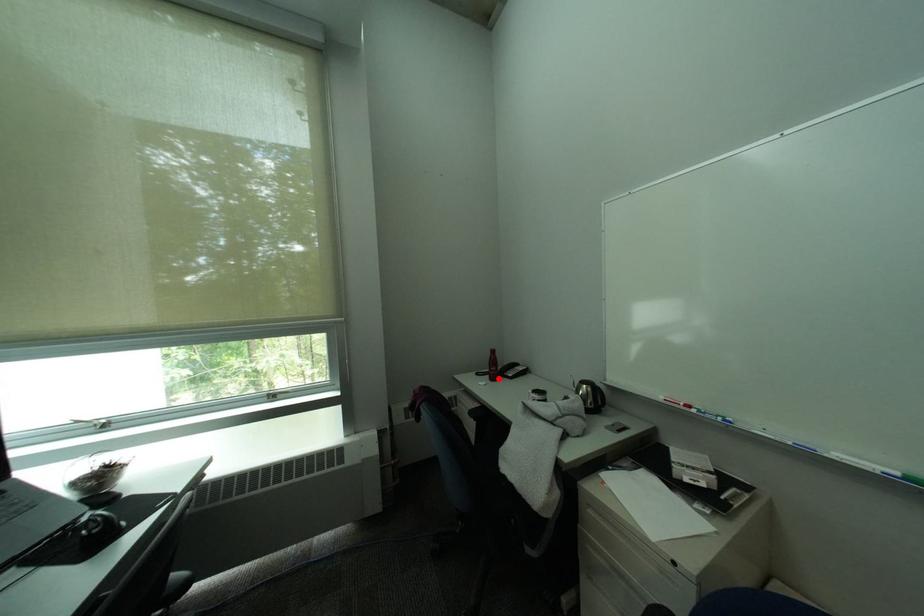
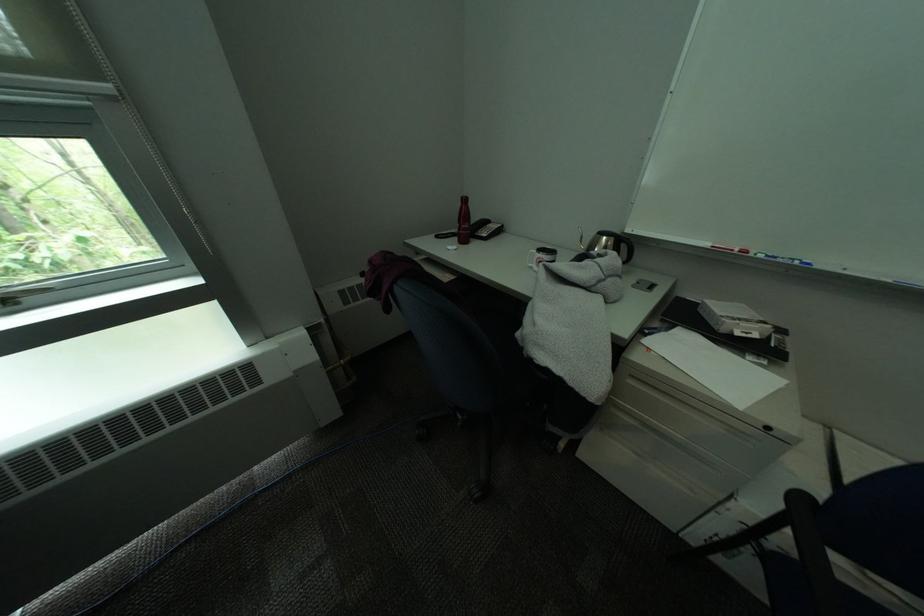
Question: I am providing you with two images of the same scene from different viewpoints. Given a red point in image1, look at the same physical point in image2. Is it:

Choices:
 (A) Closer to the viewpoint
 (B) Farther from the viewpoint

Answer: (A)